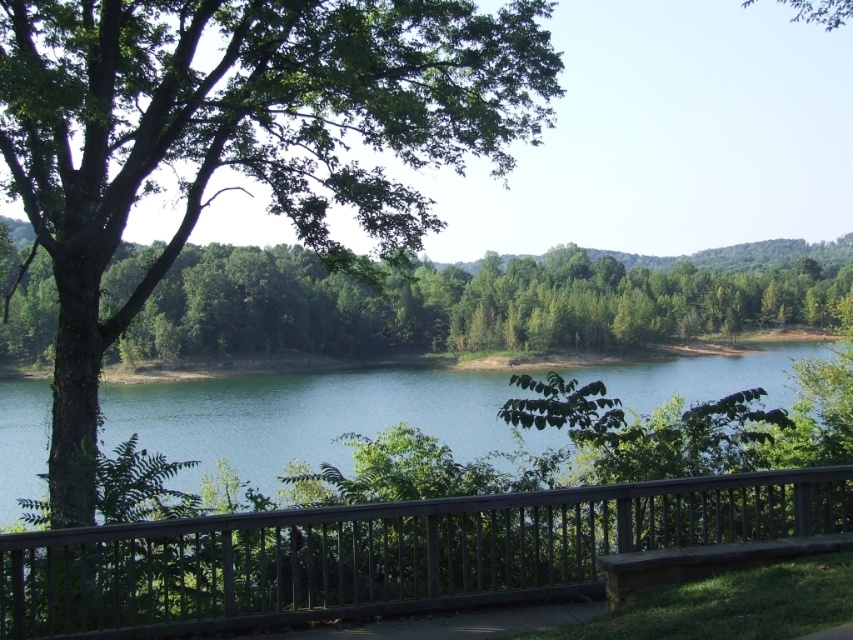
Question: Does green leafy tree at center appear over green water at center?

Choices:
 (A) no
 (B) yes

Answer: (B)

Question: Does dark brown wooden rail at center appear on the left side of green water at center?

Choices:
 (A) no
 (B) yes

Answer: (A)

Question: In this image, where is green leafy tree at center located relative to green water at center?

Choices:
 (A) left
 (B) right

Answer: (B)

Question: Which point is farther to the camera?

Choices:
 (A) green leafy tree at center
 (B) dark brown wooden rail at center
 (C) green water at center

Answer: (C)

Question: Which point appears farthest from the camera in this image?

Choices:
 (A) (422, 577)
 (B) (109, 442)
 (C) (276, 339)

Answer: (C)

Question: Which point is farther to the camera?

Choices:
 (A) green water at center
 (B) dark brown wooden rail at center

Answer: (A)